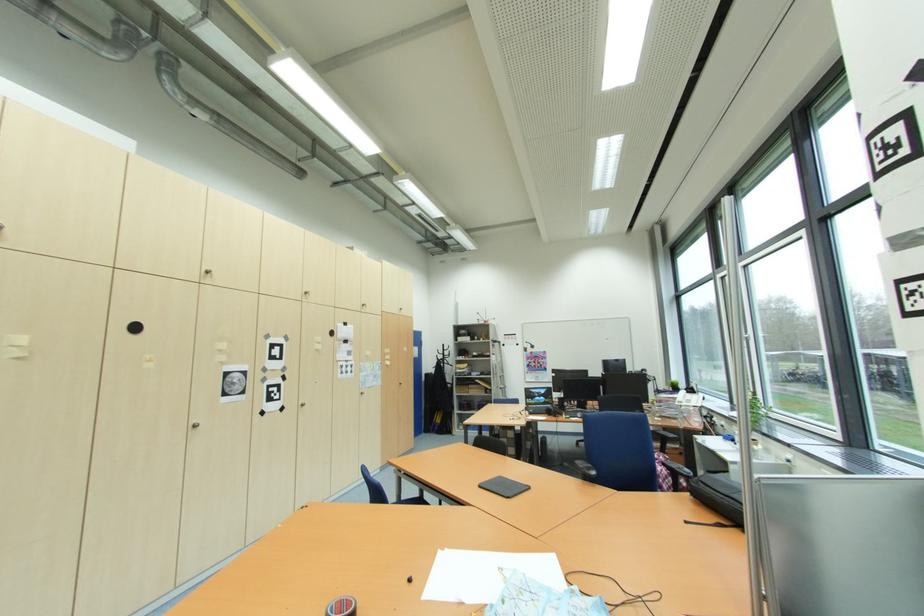
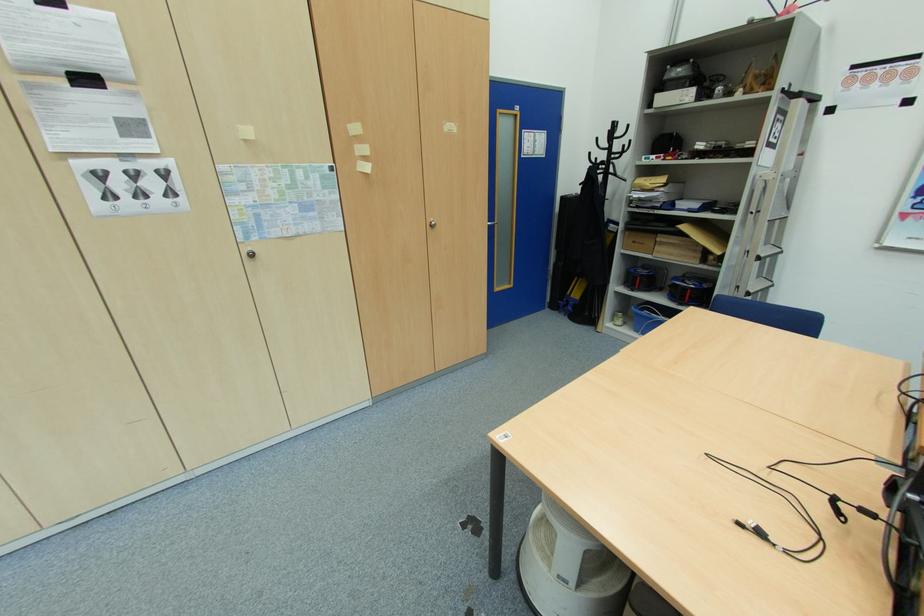
Find the pixel in the second image that matches (x=468, y=411) in the first image.

(637, 291)